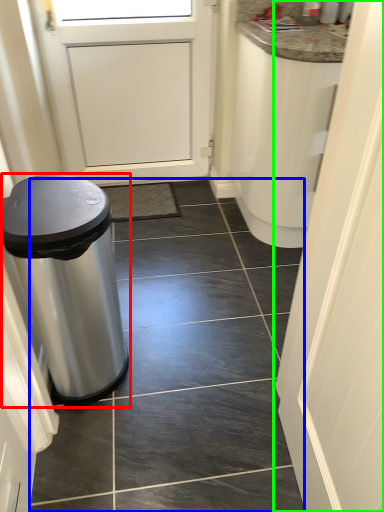
Question: Which object is positioned closest to waste container (highlighted by a red box)? Select from tile (highlighted by a blue box) and door (highlighted by a green box).

Choices:
 (A) tile
 (B) door

Answer: (A)